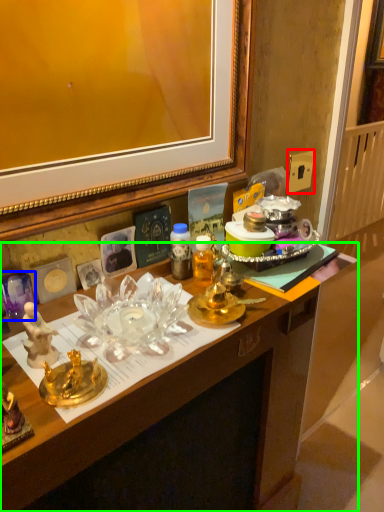
Question: Which object is the closest to the power outlet (highlighted by a red box)? Choose among these: plate (highlighted by a blue box) or desk (highlighted by a green box).

Choices:
 (A) plate
 (B) desk

Answer: (B)